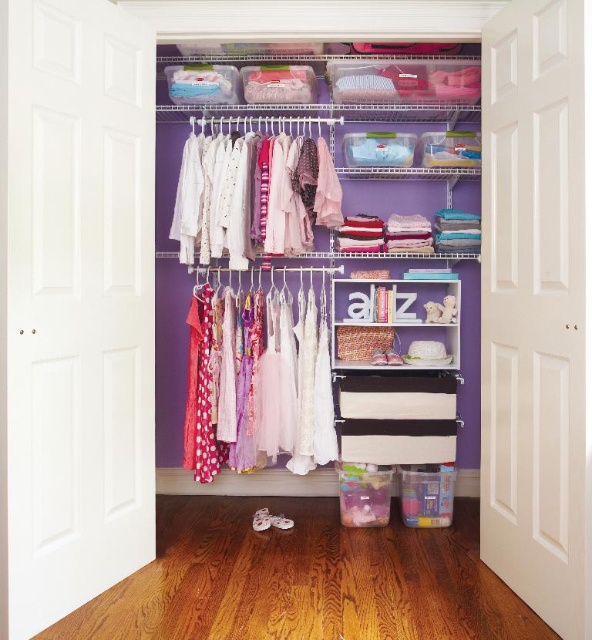
You are organizing the closet and need to place a new item between the matte white shirts at center and the white matte shelf at center. Based on their positions, which side should you place the item on to ensure it is between them?

The matte white shirts at center is to the left of the white matte shelf at center, so placing the new item to the right of the matte white shirts at center and to the left of the white matte shelf at center would position it between them.

You are organizing the closet and need to access the white matte shelf at center. However, there are matte white shirts at center blocking your view. Can you reach the shelf without moving the shirts?

The matte white shirts at center are closer to the viewer than the white matte shelf at center, so you cannot reach the shelf without moving the shirts.

You are a parent looking for a shirt for your child. You see the polka dot fabric dresses at center and the matte white shirts at center in the closet. Which item is closer to you when you open the closet door?

The polka dot fabric dresses at center are closer to you because the matte white shirts at center are behind them.